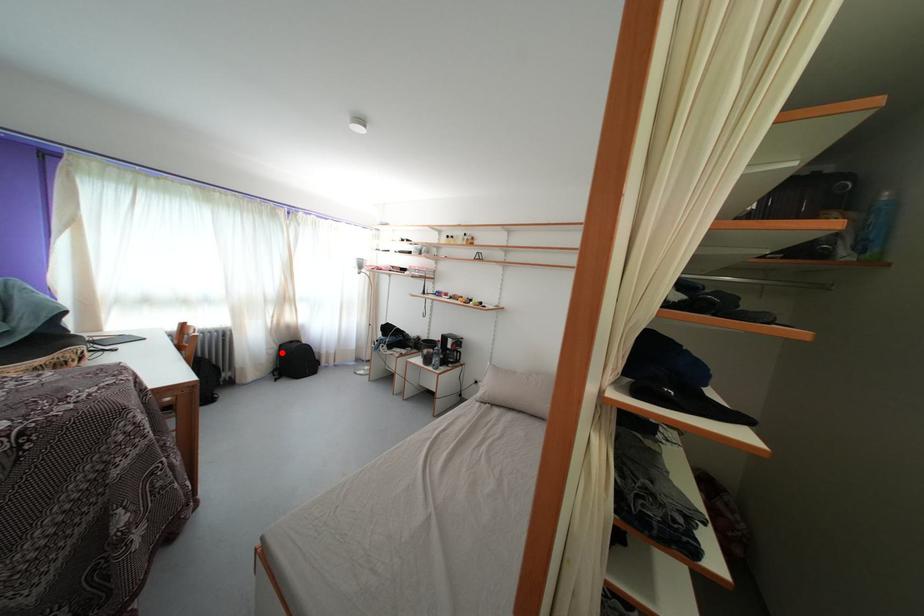
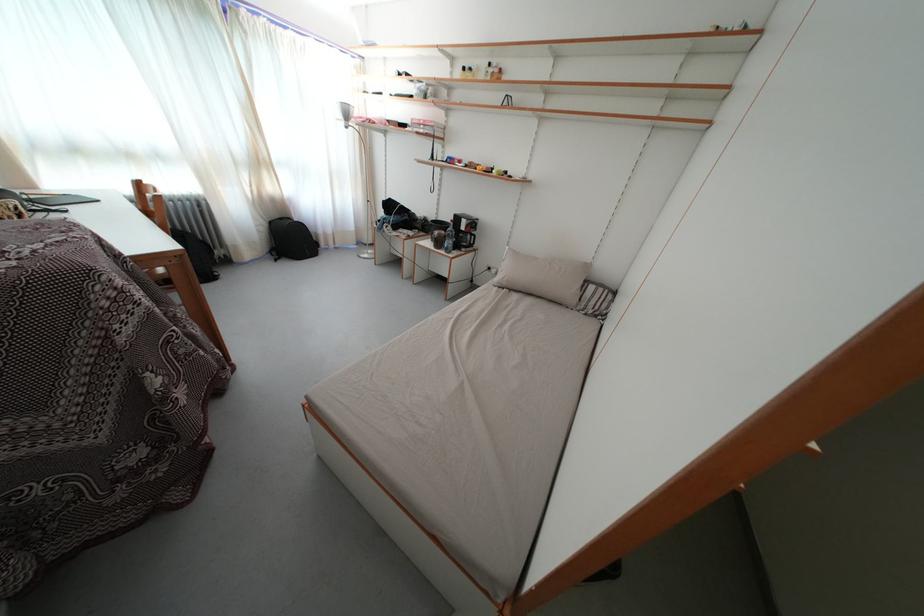
Find the pixel in the second image that matches the highlighted location in the first image.

(272, 230)